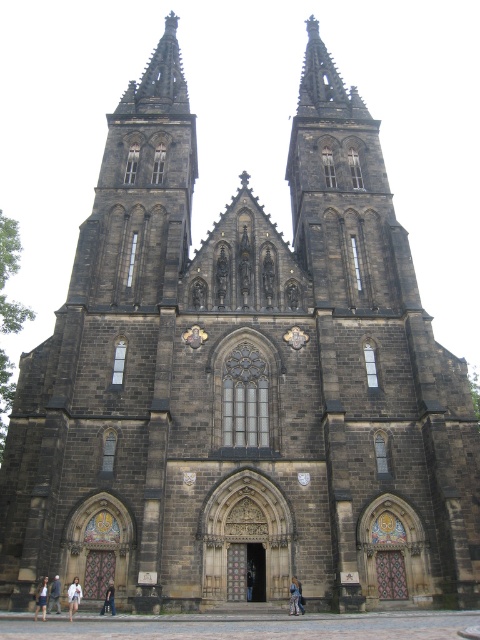
Between denim shorts at lower center and light brown leather jacket at center, which one appears on the right side from the viewer's perspective?

light brown leather jacket at center is more to the right.

Where is `denim shorts at lower center`? denim shorts at lower center is located at coordinates (40, 598).

Identify the location of denim shorts at lower center. (40, 598).

Based on the photo, is blue denim jeans at lower center to the left of light blue denim jeans at lower left from the viewer's perspective?

Incorrect, blue denim jeans at lower center is not on the left side of light blue denim jeans at lower left.

Does point (291, 611) lie behind point (56, 605)?

No, (291, 611) is closer to viewer.

Between point (290, 593) and point (55, 573), which one is positioned in front?

Point (290, 593) is in front.

Find the location of a particular element. blue denim jeans at lower center is located at coordinates (295, 596).

Is blue denim jeans at lower center to the right of denim shorts at lower center from the viewer's perspective?

Indeed, blue denim jeans at lower center is positioned on the right side of denim shorts at lower center.

Who is more forward, [291,579] or [41,580]?

Point [41,580]

Locate an element on the screen. This screenshot has width=480, height=640. blue denim jeans at lower center is located at coordinates (295, 596).